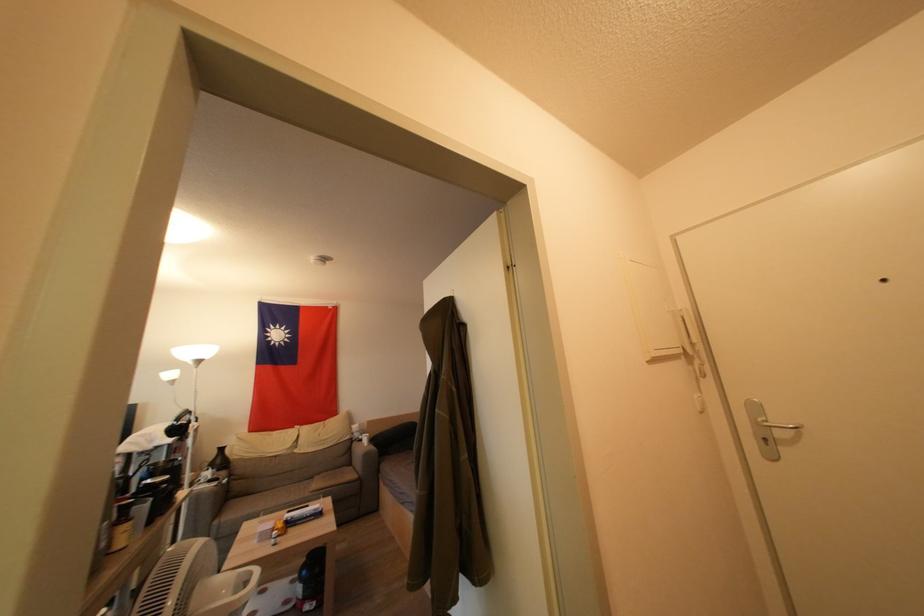
Identify the location of black remote control. (301, 514).